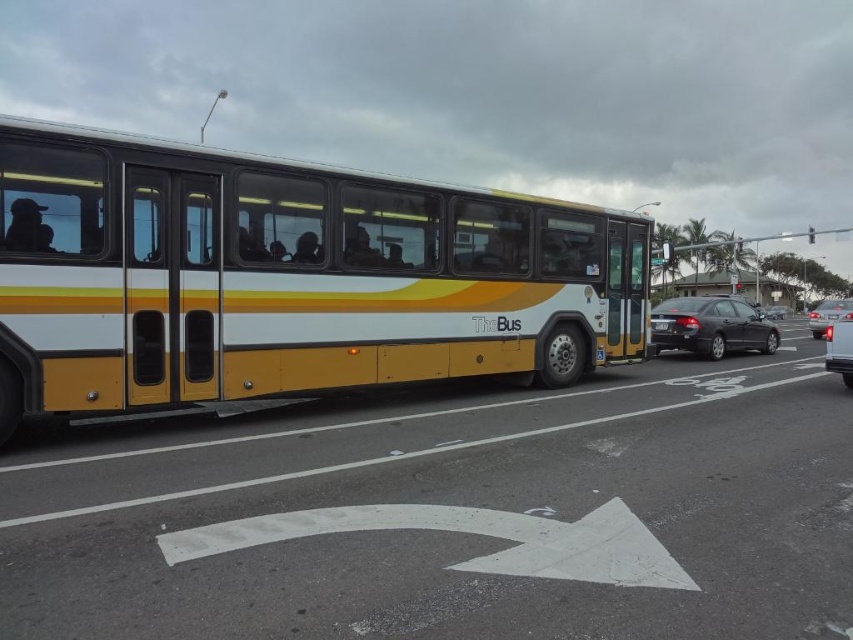
You are a pedestrian standing at the crosswalk and see the satin black sedan at center and the glossy silver sedan at right. Which car is taller?

The satin black sedan at center is taller than the glossy silver sedan at right.

You are a pedestrian standing at the crosswalk and see the satin black sedan at center and the glossy silver sedan at right. Which car is closer to you?

The satin black sedan at center is closer to you because it is positioned over the glossy silver sedan at right, meaning it is in front of it.

You are a delivery person who needs to park your delivery van between the yellow matte bus at center and the shiny silver sedan at right. The van requires 3 meters of space to park. Can you fit your van between them?

The yellow matte bus at center occupies less space than shiny silver sedan at right, but the description does not provide specific measurements of the distance between them. Therefore, it is unclear if there is enough space for the van to park.